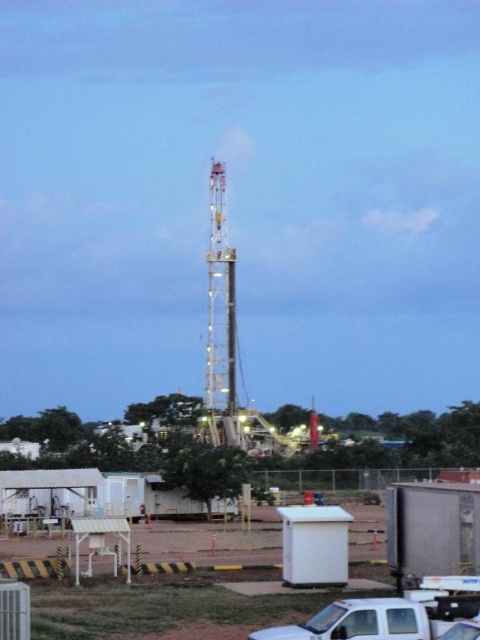
Question: Can you confirm if white plastic container at lower center is positioned to the right of white matte truck at lower center?

Choices:
 (A) no
 (B) yes

Answer: (A)

Question: Which of these objects is positioned closest to the white plastic container at lower center?

Choices:
 (A) white matte truck at lower center
 (B) metallic silver trailer truck at lower right

Answer: (B)

Question: Can you confirm if metallic silver trailer truck at lower right is positioned to the left of white matte truck at lower center?

Choices:
 (A) yes
 (B) no

Answer: (B)

Question: Which object is closer to the camera taking this photo?

Choices:
 (A) white plastic container at lower center
 (B) metallic silver trailer truck at lower right

Answer: (A)

Question: Does white plastic container at lower center appear on the right side of metallic silver trailer truck at lower right?

Choices:
 (A) no
 (B) yes

Answer: (A)

Question: Among these objects, which one is farthest from the camera?

Choices:
 (A) white plastic container at lower center
 (B) white matte truck at lower center

Answer: (B)